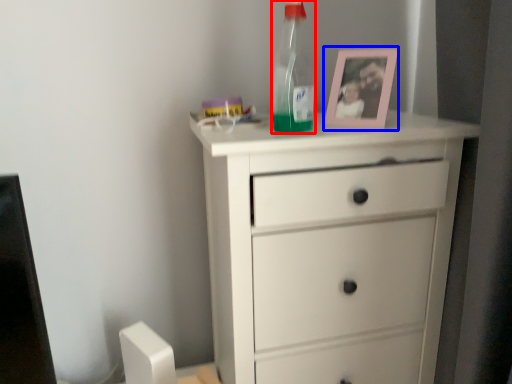
Question: Which of the following is the farthest to the observer, bottle (highlighted by a red box) or picture frame (highlighted by a blue box)?

Choices:
 (A) bottle
 (B) picture frame

Answer: (B)